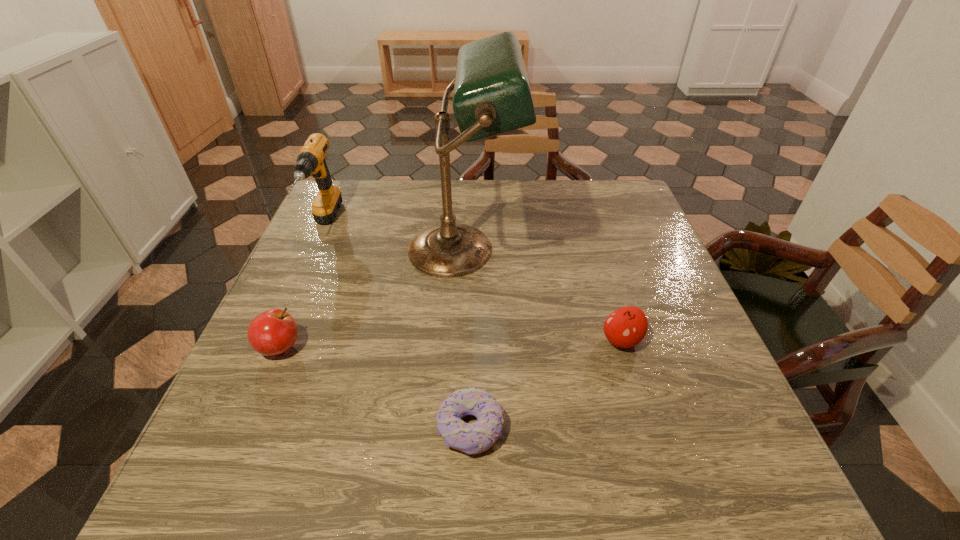
Find the location of a particular element. vacant area that lies between the left apple and the drill is located at coordinates (301, 287).

Locate an element on the screen. vacant area that lies between the rightmost object and the table lamp is located at coordinates (542, 295).

Find the location of a particular element. This screenshot has height=540, width=960. vacant space in between the doughnut and the second tallest object is located at coordinates (397, 327).

Find the location of a particular element. This screenshot has height=540, width=960. the second closest object to the right apple is located at coordinates coord(474,438).

Identify the location of the third closest object to the second tallest object. (474, 438).

Locate an element on the screen. The width and height of the screenshot is (960, 540). blank area in the image that satisfies the following two spatial constraints: 1. above the green lampshade of the table lamp; 2. on the left side of the rightmost object is located at coordinates [x=459, y=340].

Identify the location of vacant space that satisfies the following two spatial constraints: 1. at the tip of the drill; 2. on the left side of the left apple. This screenshot has height=540, width=960. (269, 347).

Find the location of `free space that satisfies the following two spatial constraints: 1. at the tip of the left apple; 2. on the right side of the fourth shortest object`. free space that satisfies the following two spatial constraints: 1. at the tip of the left apple; 2. on the right side of the fourth shortest object is located at coordinates (269, 347).

This screenshot has width=960, height=540. Find the location of `vacant space that satisfies the following two spatial constraints: 1. above the green lampshade of the table lamp; 2. on the right side of the doughnut`. vacant space that satisfies the following two spatial constraints: 1. above the green lampshade of the table lamp; 2. on the right side of the doughnut is located at coordinates (455, 428).

You are a GUI agent. You are given a task and a screenshot of the screen. Output one action in this format:
    pyautogui.click(x=<x>, y=<y>)
    Task: Click on the vacant space that satisfies the following two spatial constraints: 1. at the tip of the right apple; 2. on the left side of the fourth shortest object
    
    Given the screenshot: What is the action you would take?
    pyautogui.click(x=272, y=340)